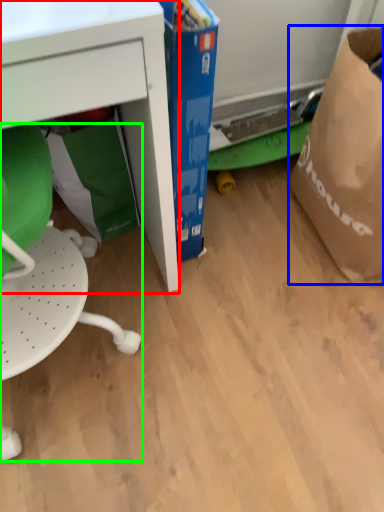
Question: Which object is the closest to the desk (highlighted by a red box)? Choose among these: grocery bag (highlighted by a blue box) or swivel chair (highlighted by a green box).

Choices:
 (A) grocery bag
 (B) swivel chair

Answer: (B)